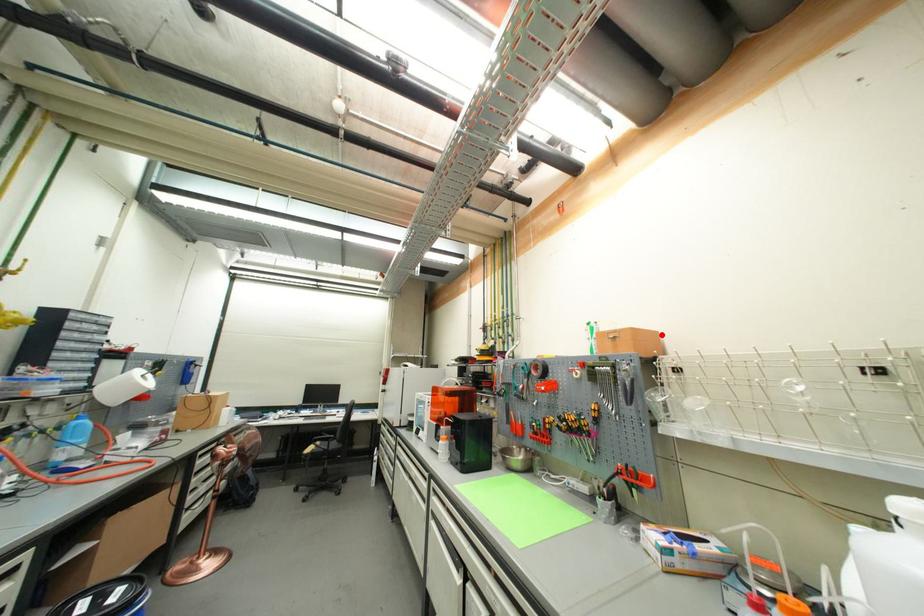
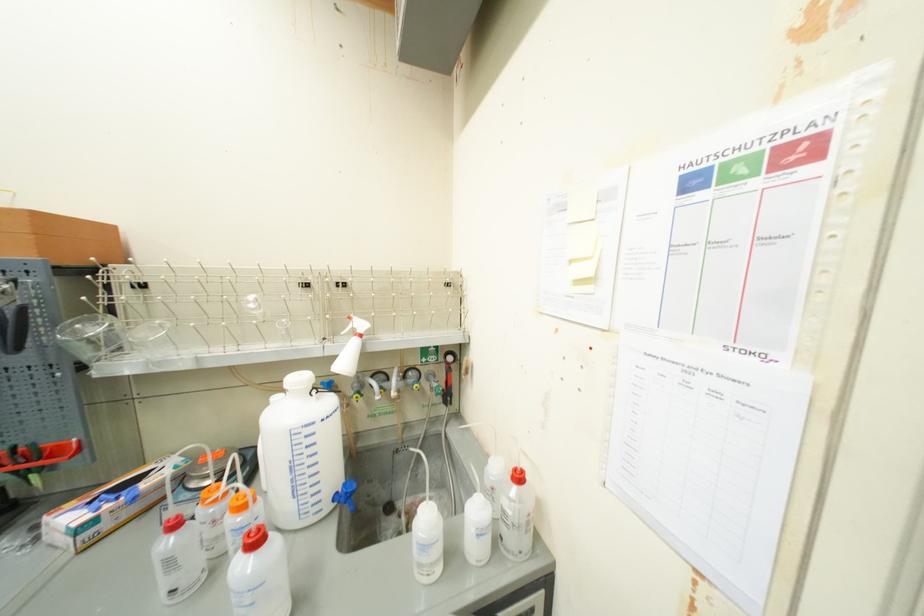
The point at the highlighted location is marked in the first image. Where is the corresponding point in the second image?

(117, 229)